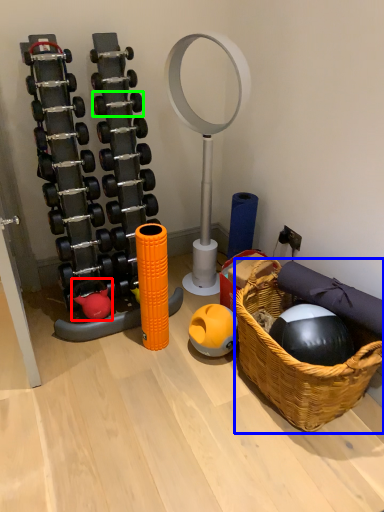
Question: Which object is positioned closest to toy (highlighted by a red box)? Select from basket (highlighted by a blue box) and dumbbell (highlighted by a green box).

Choices:
 (A) basket
 (B) dumbbell

Answer: (B)